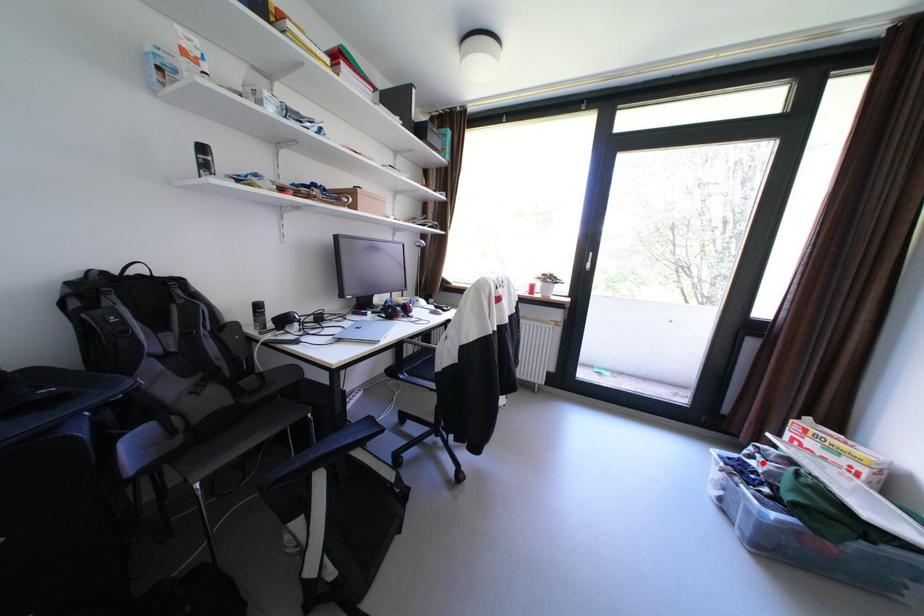
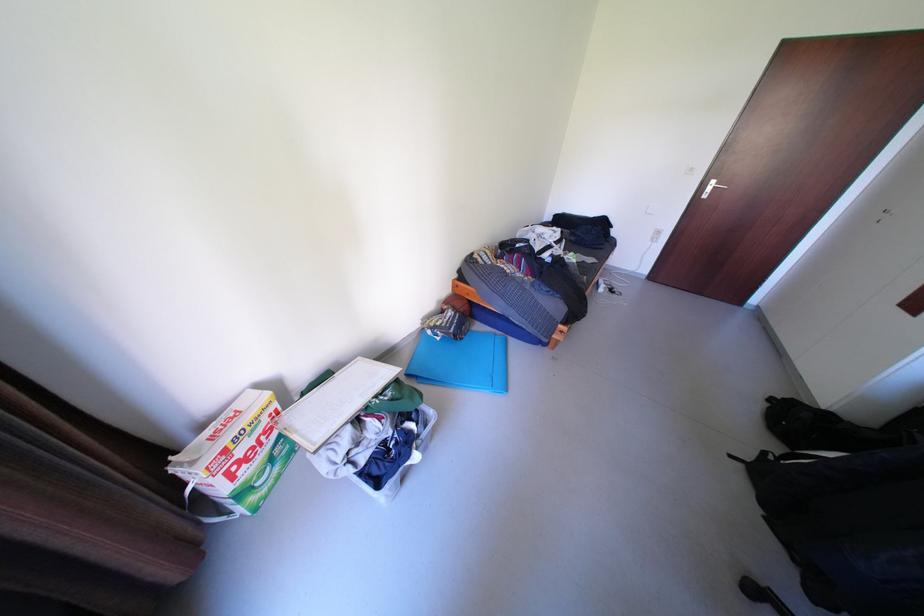
Question: I am providing you with two images of the same scene from different viewpoints. Given a red point in image1, look at the same physical point in image2. Is it:

Choices:
 (A) Closer to the viewpoint
 (B) Farther from the viewpoint

Answer: (A)